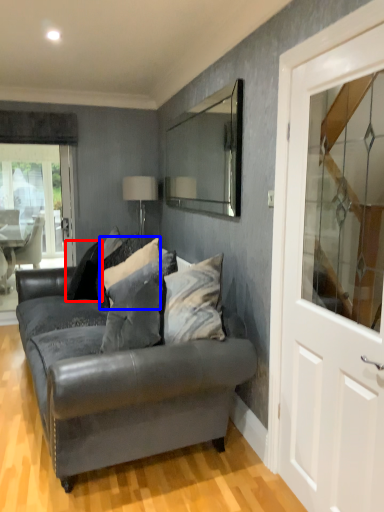
Question: Which object appears closest to the camera in this image, pillow (highlighted by a red box) or pillow (highlighted by a blue box)?

Choices:
 (A) pillow
 (B) pillow

Answer: (B)